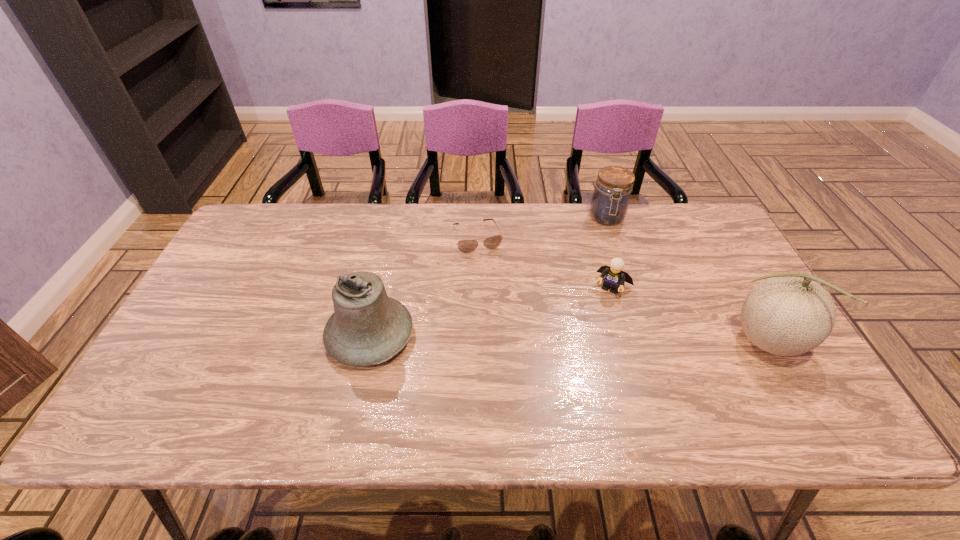
Where is `free space on the desktop that is between the second tallest object and the tallest object and is positioned on the front-facing side of the sunglasses`? This screenshot has height=540, width=960. free space on the desktop that is between the second tallest object and the tallest object and is positioned on the front-facing side of the sunglasses is located at coordinates (511, 338).

Where is `free space on the desktop that is between the fourth shortest object and the cantaloup and is positioned on the lid of the jar`? This screenshot has height=540, width=960. free space on the desktop that is between the fourth shortest object and the cantaloup and is positioned on the lid of the jar is located at coordinates (622, 340).

You are a GUI agent. You are given a task and a screenshot of the screen. Output one action in this format:
    pyautogui.click(x=<x>, y=<y>)
    Task: Click on the free space on the desktop that is between the bell and the rightmost object and is positioned on the front-facing side of the fourth tallest object
    The width and height of the screenshot is (960, 540).
    Given the screenshot: What is the action you would take?
    pyautogui.click(x=586, y=339)